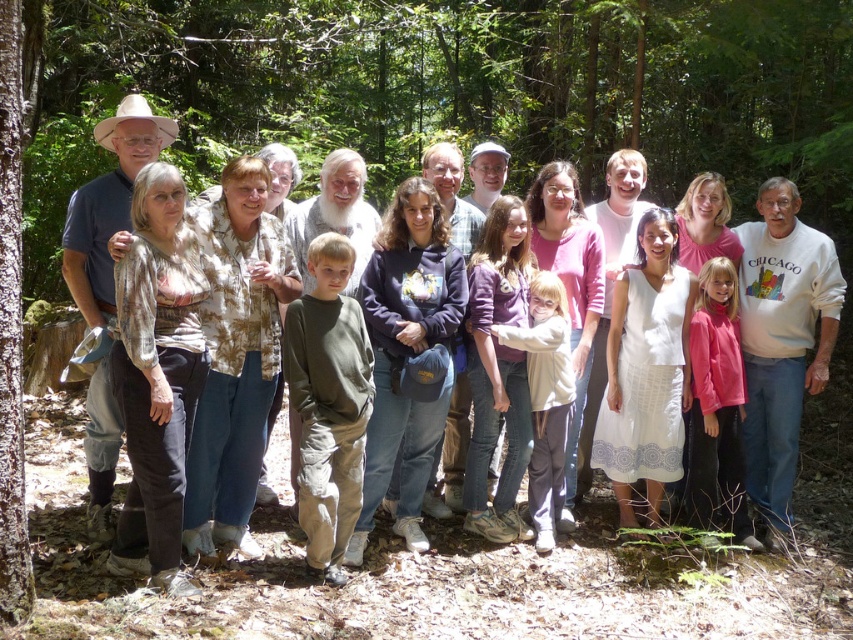
Who is more distant from viewer, (119, 442) or (0, 456)?

The point (119, 442) is more distant.

How far apart are plaid shirt at center and brown rough bark tree at left?

plaid shirt at center and brown rough bark tree at left are 5.27 feet apart.

Is point (138, 115) positioned before point (9, 252)?

No, it is not.

Identify the location of plaid shirt at center. (108, 205).

Which is above, white cotton sweatshirt at right or brown rough bark tree at left?

brown rough bark tree at left

Is the position of white cotton sweatshirt at right less distant than that of brown rough bark tree at left?

No.

Is point (819, 310) positioned after point (21, 573)?

That is True.

Where is `white cotton sweatshirt at right`? This screenshot has height=640, width=853. white cotton sweatshirt at right is located at coordinates (782, 340).

Does white cotton sweatshirt at right appear on the left side of matte khaki pants at center?

No, white cotton sweatshirt at right is not to the left of matte khaki pants at center.

Can you confirm if white cotton sweatshirt at right is positioned above matte khaki pants at center?

Actually, white cotton sweatshirt at right is below matte khaki pants at center.

You are a GUI agent. You are given a task and a screenshot of the screen. Output one action in this format:
    pyautogui.click(x=<x>, y=<y>)
    Task: Click on the white cotton sweatshirt at right
    This screenshot has height=640, width=853.
    Given the screenshot: What is the action you would take?
    pyautogui.click(x=782, y=340)